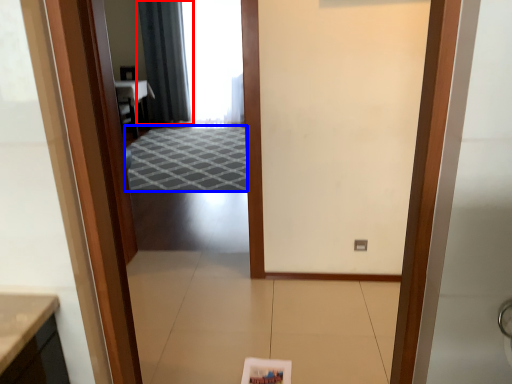
Question: Among these objects, which one is nearest to the camera, curtain (highlighted by a red box) or doormat (highlighted by a blue box)?

Choices:
 (A) curtain
 (B) doormat

Answer: (B)